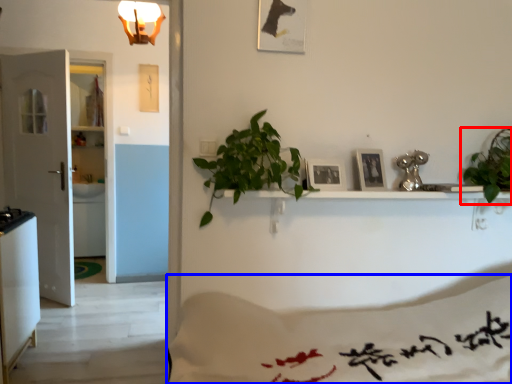
Question: Which point is further to the camera, houseplant (highlighted by a red box) or sheet (highlighted by a blue box)?

Choices:
 (A) houseplant
 (B) sheet

Answer: (A)